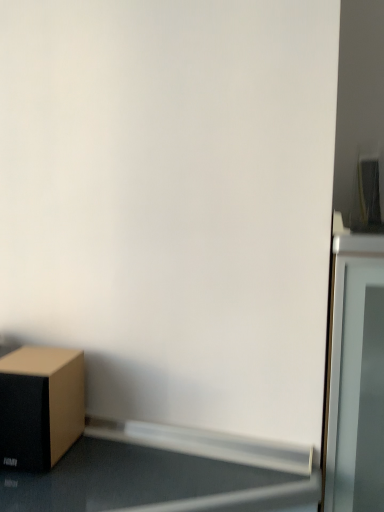
In order to face brown cardboard box at lower left, should I rotate leftwards or rightwards?

Turn left approximately 20.229 degrees to face it.

Identify the location of brown cardboard box at lower left. This screenshot has height=512, width=384. (40, 406).

Image resolution: width=384 pixels, height=512 pixels. What do you see at coordinates (40, 406) in the screenshot? I see `brown cardboard box at lower left` at bounding box center [40, 406].

Measure the distance between brown cardboard box at lower left and camera.

brown cardboard box at lower left and camera are 28.67 inches apart from each other.

I want to click on brown cardboard box at lower left, so click(40, 406).